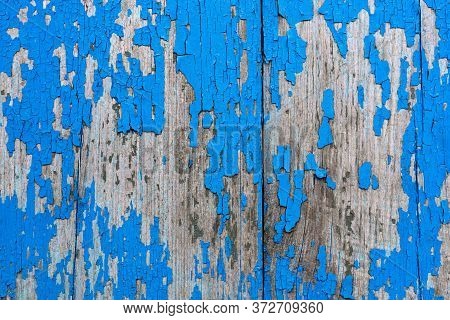
This screenshot has width=450, height=320. What are the coordinates of `nail hole` in the screenshot? It's located at (353, 74), (288, 110).